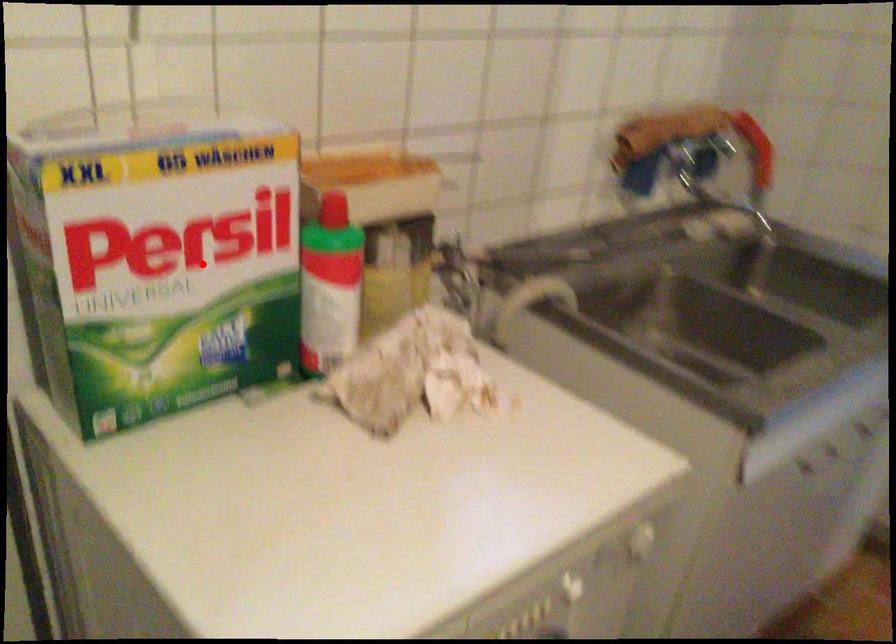
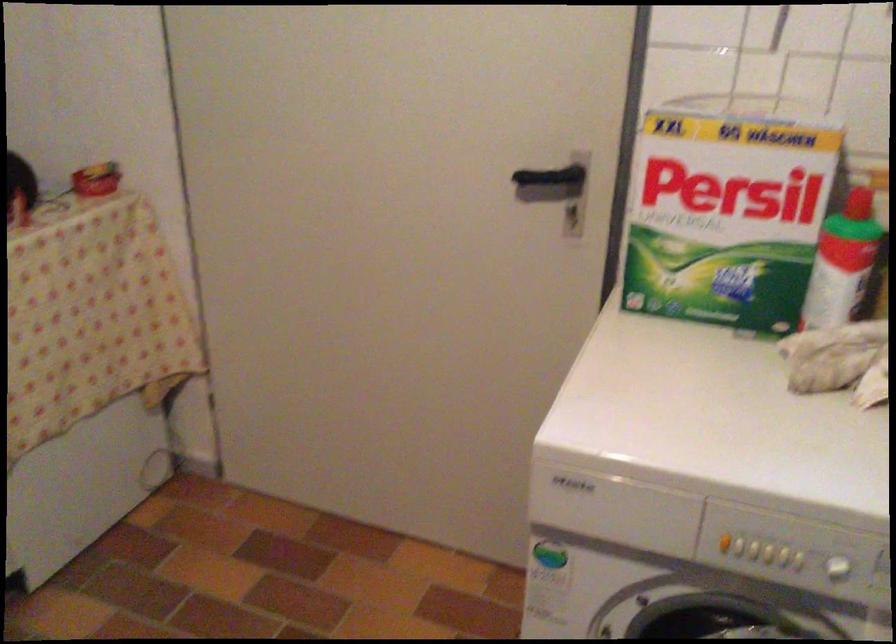
Find the pixel in the second image that matches the highlighted location in the first image.

(728, 210)